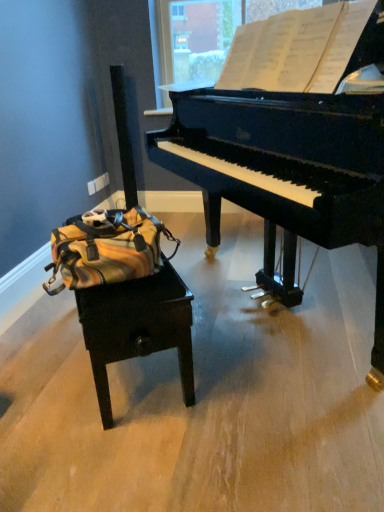
Find the location of a particular element. Image resolution: width=384 pixels, height=512 pixels. vacant area that lies to the right of wooden table at lower left is located at coordinates (264, 348).